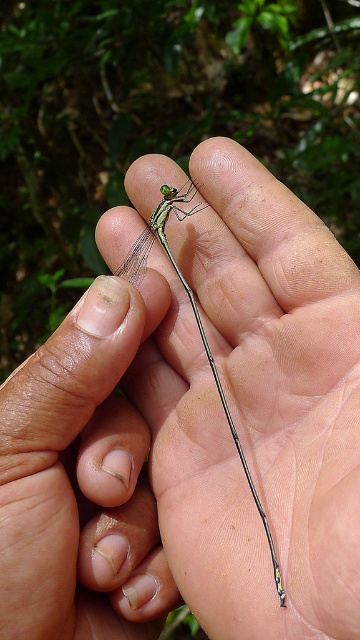
You are a photographer trying to focus on two points in the image of a hand holding a dragonfly. The points are labeled as point (60, 460) and point (182, 275). Which point should you focus on first if you want to capture the closest one to the viewer?

Point (60, 460) is closer to the viewer than point (182, 275), so you should focus on point (60, 460) first.

You are a nature photographer trying to capture a closeup of both the transparent glass mantid at center and the transparent green dragonfly at center. Since you want them both in focus, you need to know which one is closer to you. Based on the scene, can you determine which insect is closer?

The transparent glass mantid at center is to the left of the transparent green dragonfly at center, but their positions left or right do not indicate distance. Without depth cues like overlap or perspective, we cannot determine which is closer based on the given information.

What object is located at the point coordinates of [82,480] in the image?

The point coordinates of [82,480] mark the location of the transparent glass mantid at center.